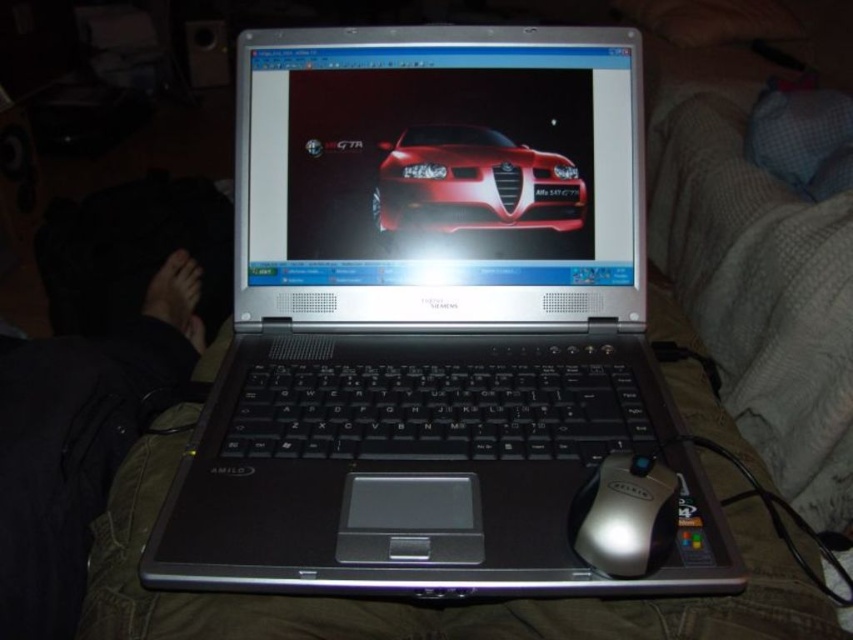
Is silver/black plastic laptop at center behind glossy red car at center?

No.

Does silver/black plastic laptop at center have a lesser height compared to glossy red car at center?

No.

Identify the location of silver/black plastic laptop at center. (431, 321).

Is point (567, 221) more distant than point (604, 561)?

Yes, it is behind point (604, 561).

Between point (376, 220) and point (624, 532), which one is positioned in front?

Positioned in front is point (624, 532).

The image size is (853, 640). In order to click on glossy red car at center in this screenshot , I will do `click(473, 182)`.

Who is more distant from viewer, (657, 428) or (675, 484)?

The point (657, 428) is more distant.

Who is more distant from viewer, (283, 522) or (674, 522)?

The point (283, 522) is more distant.

Locate an element on the screen. Image resolution: width=853 pixels, height=640 pixels. silver/black plastic laptop at center is located at coordinates (431, 321).